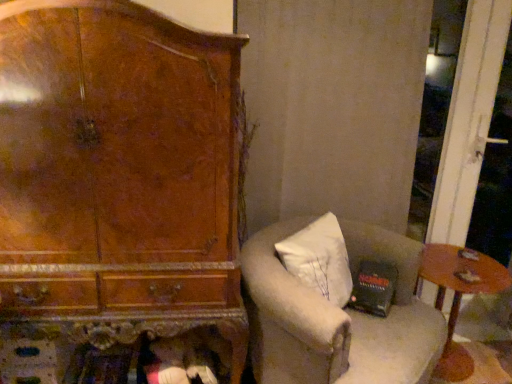
Question: From the image's perspective, is wooden round table at lower right positioned above or below white fabric chair at center?

Choices:
 (A) above
 (B) below

Answer: (B)

Question: Is wooden round table at lower right in front of or behind white fabric chair at center in the image?

Choices:
 (A) front
 (B) behind

Answer: (B)

Question: Looking at their shapes, would you say wooden round table at lower right is wider or thinner than white fabric chair at center?

Choices:
 (A) thin
 (B) wide

Answer: (A)

Question: Is white fabric chair at center taller or shorter than wooden round table at lower right?

Choices:
 (A) tall
 (B) short

Answer: (A)

Question: Visually, is white fabric chair at center positioned to the left or to the right of wooden round table at lower right?

Choices:
 (A) right
 (B) left

Answer: (B)

Question: Choose the correct answer: Is white fabric chair at center inside wooden round table at lower right or outside it?

Choices:
 (A) inside
 (B) outside

Answer: (B)

Question: Does point (440, 326) appear closer or farther from the camera than point (460, 276)?

Choices:
 (A) closer
 (B) farther

Answer: (A)